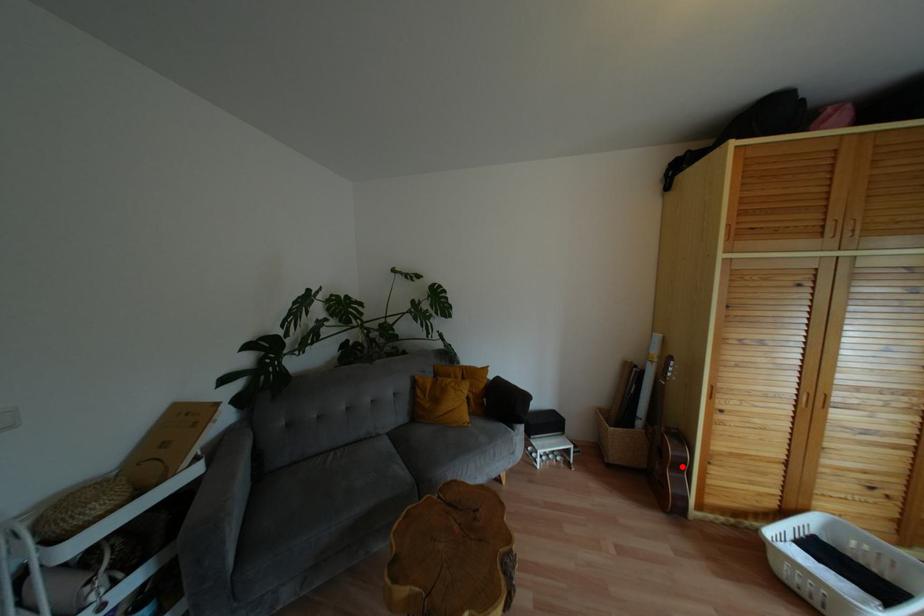
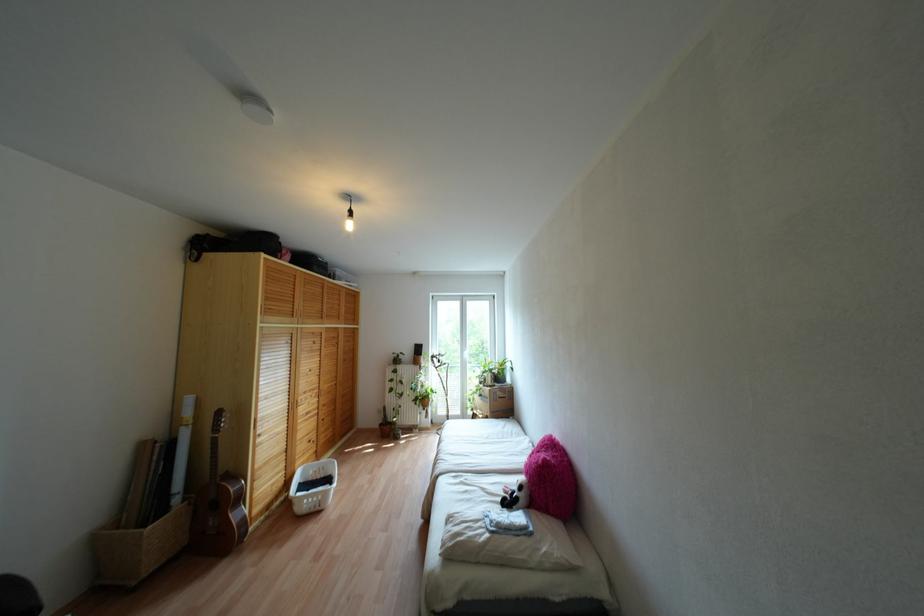
Question: I am providing you with two images of the same scene from different viewpoints. A red point is shown in image1. For the corresponding object point in image2, is it positioned nearer or farther from the camera?

Choices:
 (A) Nearer
 (B) Farther

Answer: (A)